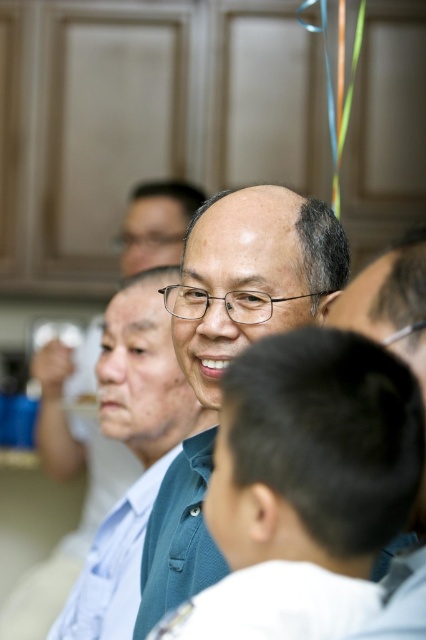
Is point (242, 346) positioned in front of point (88, 589)?

Yes, it is.

Which of these two, green matte shirt at center or matte blue shirt at center, stands shorter?

With less height is green matte shirt at center.

Describe the element at coordinates (250, 276) in the screenshot. I see `green matte shirt at center` at that location.

At what (x,y) coordinates should I click in order to perform the action: click on green matte shirt at center. Please return your answer as a coordinate pair (x, y). Image resolution: width=426 pixels, height=640 pixels. Looking at the image, I should click on (250, 276).